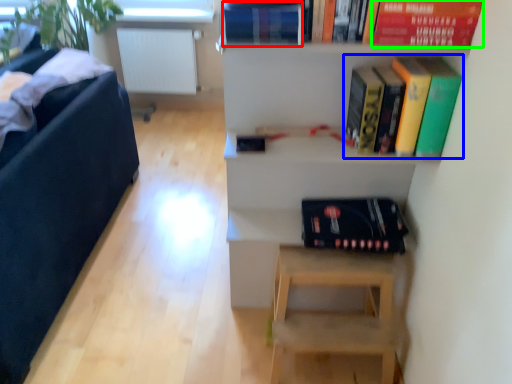
Question: Considering the real-world distances, which object is closest to paperback book (highlighted by a red box)? book (highlighted by a blue box) or paperback book (highlighted by a green box).

Choices:
 (A) book
 (B) paperback book

Answer: (B)